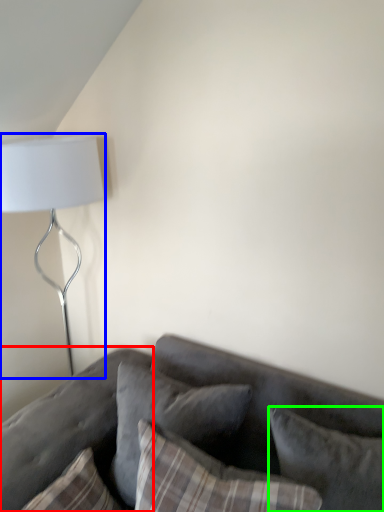
Question: Based on their relative distances, which object is farther from pillow (highlighted by a red box)? Choose from lamp (highlighted by a blue box) and pillow (highlighted by a green box).

Choices:
 (A) lamp
 (B) pillow

Answer: (A)